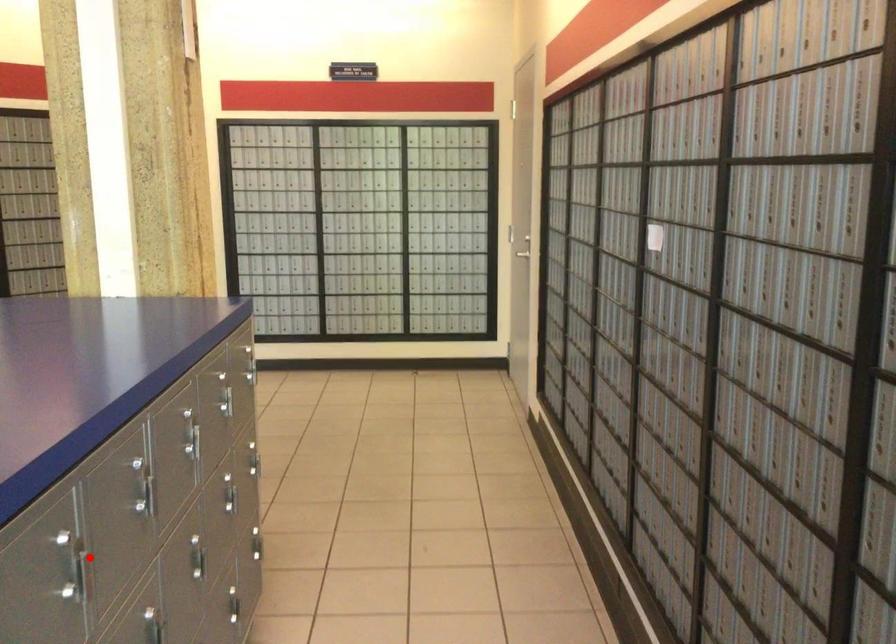
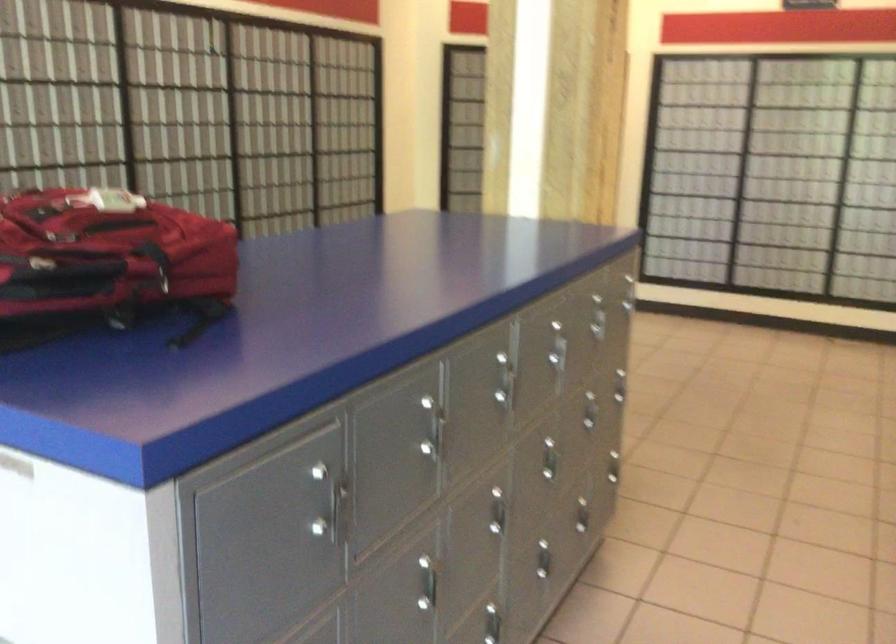
Question: A red point is marked in image1. In image2, is the corresponding 3D point closer to the camera or farther? Reply with the corresponding letter.

Choices:
 (A) The corresponding 3D point is closer.
 (B) The corresponding 3D point is farther.

Answer: (B)